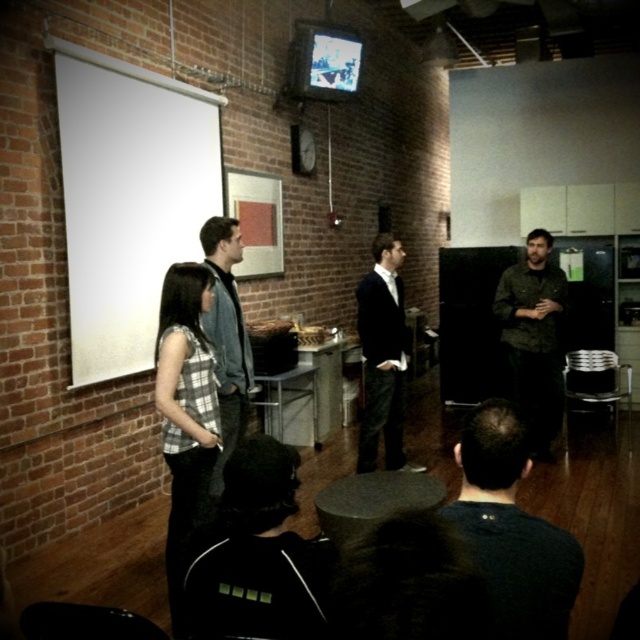
Question: Is white matte projection screen at upper left smaller than plaid fabric shirt at center?

Choices:
 (A) yes
 (B) no

Answer: (B)

Question: Is white matte projection screen at upper left bigger than plaid fabric shirt at center?

Choices:
 (A) yes
 (B) no

Answer: (A)

Question: Which object appears closest to the camera in this image?

Choices:
 (A) dark gray sweater at lower right
 (B) black fabric jacket at lower center
 (C) white matte projection screen at upper left

Answer: (A)

Question: Which object appears closest to the camera in this image?

Choices:
 (A) denim jacket at center
 (B) plaid fabric shirt at center
 (C) black fabric jacket at lower center

Answer: (C)

Question: Does black fabric jacket at lower center come in front of camouflage jacket at center?

Choices:
 (A) no
 (B) yes

Answer: (B)

Question: Which point is closer to the camera?

Choices:
 (A) (240, 493)
 (B) (179, 470)

Answer: (A)